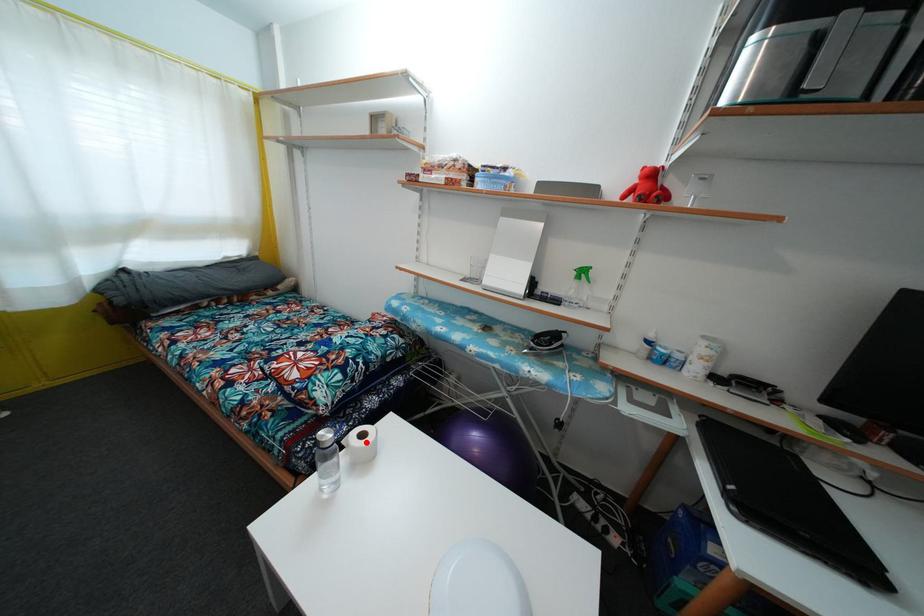
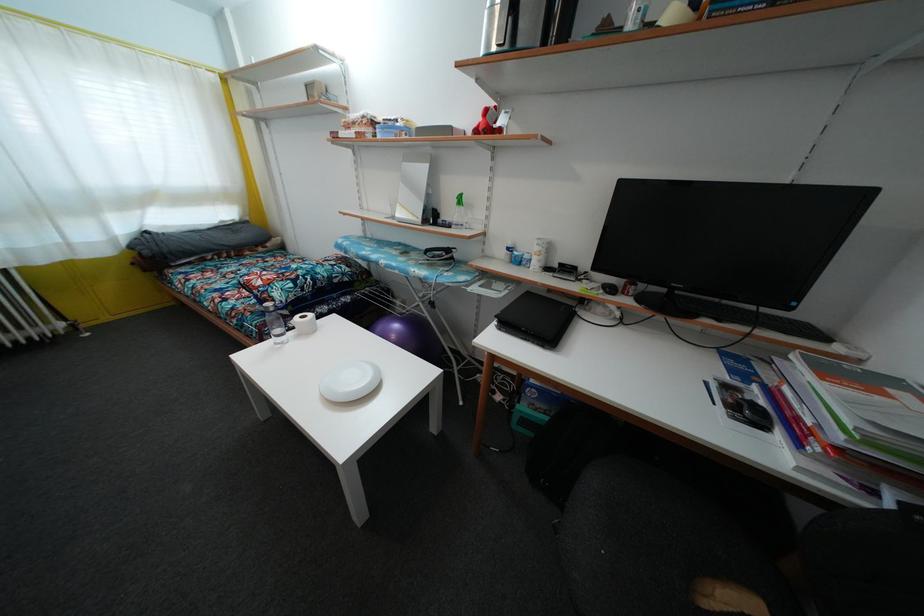
In the second image, find the point that corresponds to the highlighted location in the first image.

(307, 323)